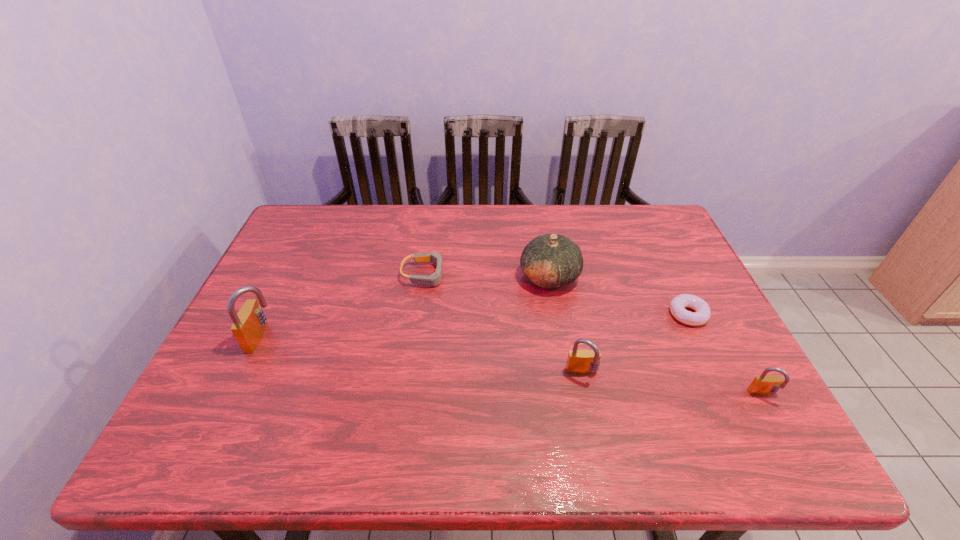
Identify the location of free space located 0.360m on the front of the gourd. click(x=573, y=414).

The width and height of the screenshot is (960, 540). Find the location of `vacant space located 0.170m on the front and back of the goggles`. vacant space located 0.170m on the front and back of the goggles is located at coordinates (507, 274).

This screenshot has width=960, height=540. What are the coordinates of `vacant region located 0.220m on the back of the doughnut` in the screenshot? It's located at (658, 252).

You are a GUI agent. You are given a task and a screenshot of the screen. Output one action in this format:
    pyautogui.click(x=<x>, y=<y>)
    Task: Click on the object that is at the left edge
    The height and width of the screenshot is (540, 960).
    Given the screenshot: What is the action you would take?
    pyautogui.click(x=249, y=324)

The width and height of the screenshot is (960, 540). I want to click on padlock located at the right edge, so click(x=764, y=384).

Identify the location of doughnut that is at the right edge. (702, 313).

Locate an element on the screen. object that is at the near right corner is located at coordinates (764, 384).

In order to click on blank area at the far edge in this screenshot , I will do `click(535, 206)`.

The height and width of the screenshot is (540, 960). In the image, there is a desktop. Find the location of `free region at the near edge`. free region at the near edge is located at coordinates (458, 412).

Locate an element on the screen. This screenshot has width=960, height=540. vacant area at the right edge is located at coordinates (690, 277).